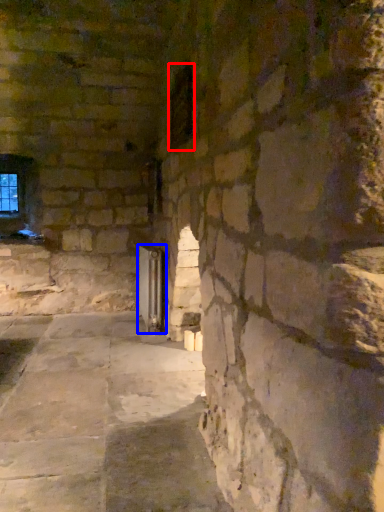
Question: Among these objects, which one is farthest to the camera, window (highlighted by a red box) or glass door (highlighted by a blue box)?

Choices:
 (A) window
 (B) glass door

Answer: (B)